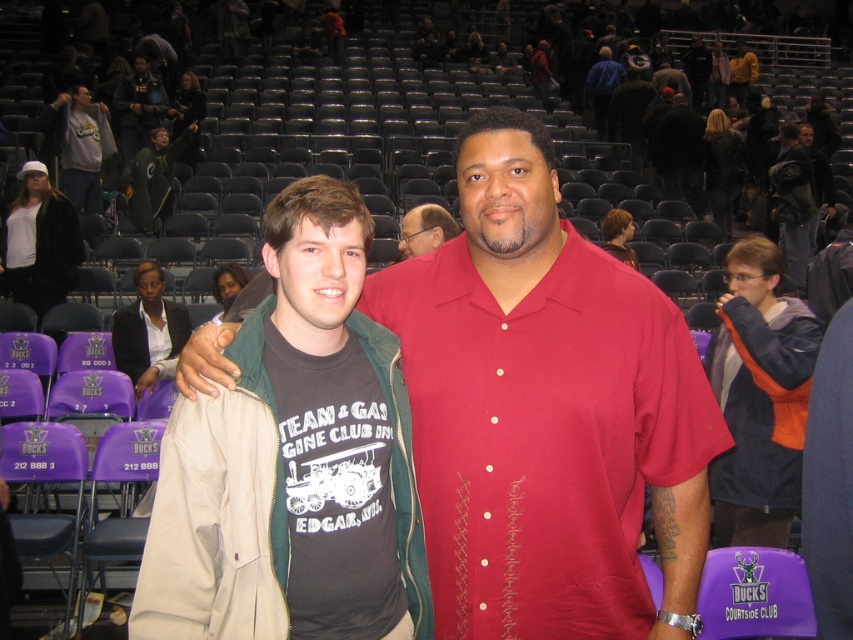
Is point (161, 129) more distant than point (416, 224)?

That is True.

Between green jersey at upper left and matte black glasses at center, which one is positioned higher?

Positioned higher is green jersey at upper left.

This screenshot has height=640, width=853. Identify the location of green jersey at upper left. (154, 177).

Can you confirm if matte gray hoodie at upper left is positioned to the right of matte black glasses at center?

In fact, matte gray hoodie at upper left is to the left of matte black glasses at center.

Is matte gray hoodie at upper left smaller than matte black glasses at center?

No, matte gray hoodie at upper left is not smaller than matte black glasses at center.

This screenshot has height=640, width=853. What do you see at coordinates (82, 147) in the screenshot?
I see `matte gray hoodie at upper left` at bounding box center [82, 147].

Where is `matte gray hoodie at upper left`? The height and width of the screenshot is (640, 853). matte gray hoodie at upper left is located at coordinates (82, 147).

Who is shorter, dark gray jacket at upper right or matte black glasses at center?

Standing shorter between the two is matte black glasses at center.

Can you confirm if dark gray jacket at upper right is taller than matte black glasses at center?

Correct, dark gray jacket at upper right is much taller as matte black glasses at center.

Between point (788, 138) and point (405, 250), which one is positioned behind?

The point (788, 138) is more distant.

Locate an element on the screen. dark gray jacket at upper right is located at coordinates (792, 202).